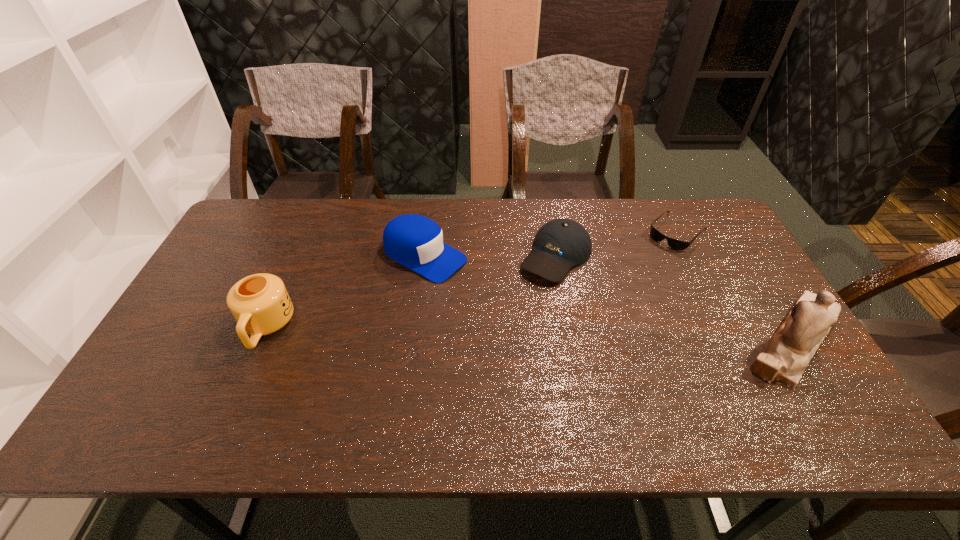
This screenshot has width=960, height=540. I want to click on vacant point that satisfies the following two spatial constraints: 1. on the handle side of the tallest object; 2. on the front-facing side of the second tallest object, so click(x=261, y=340).

Where is `free space in the image that satisfies the following two spatial constraints: 1. on the handle side of the leftmost object; 2. on the front-facing side of the figurine`? This screenshot has height=540, width=960. free space in the image that satisfies the following two spatial constraints: 1. on the handle side of the leftmost object; 2. on the front-facing side of the figurine is located at coordinates (261, 340).

Locate an element on the screen. Image resolution: width=960 pixels, height=540 pixels. free region that satisfies the following two spatial constraints: 1. on the front side of the shorter baseball cap; 2. on the front-facing side of the tallest object is located at coordinates (571, 340).

Locate an element on the screen. vacant region that satisfies the following two spatial constraints: 1. on the front side of the left baseball cap; 2. on the front-facing side of the tallest object is located at coordinates (414, 340).

At what (x,y) coordinates should I click in order to perform the action: click on free space that satisfies the following two spatial constraints: 1. on the front side of the tallest object; 2. on the front-facing side of the shortest object. Please return your answer as a coordinate pair (x, y). This screenshot has width=960, height=540. Looking at the image, I should click on (732, 340).